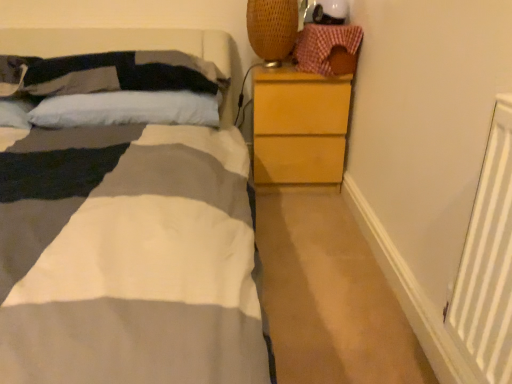
Image resolution: width=512 pixels, height=384 pixels. Describe the element at coordinates (127, 109) in the screenshot. I see `white soft pillow at upper left, the first pillow positioned from the bottom` at that location.

Locate an element on the screen. The image size is (512, 384). white soft pillow at upper left, the first pillow positioned from the bottom is located at coordinates (127, 109).

Describe the element at coordinates (324, 45) in the screenshot. I see `checkered fabric basket at upper right` at that location.

At what (x,y) coordinates should I click in order to perform the action: click on light brown wooden chest of drawers at right. Please return your answer as a coordinate pair (x, y). This screenshot has height=384, width=512. Looking at the image, I should click on (298, 126).

Which object is further away from the camera, light brown wooden chest of drawers at right or checkered fabric basket at upper right?

Positioned behind is light brown wooden chest of drawers at right.

Could you tell me if light brown wooden chest of drawers at right is turned towards checkered fabric basket at upper right?

No, light brown wooden chest of drawers at right does not turn towards checkered fabric basket at upper right.

From the picture: Is light brown wooden chest of drawers at right inside or outside of checkered fabric basket at upper right?

The correct answer is: outside.

Does light brown wooden chest of drawers at right appear on the right side of checkered fabric basket at upper right?

In fact, light brown wooden chest of drawers at right is to the left of checkered fabric basket at upper right.

Is point (157, 97) closer or farther from the camera than point (351, 32)?

Clearly, point (157, 97) is closer to the camera than point (351, 32).

Is checkered fabric basket at upper right at the back of white soft pillow at upper left, acting as the 2th pillow starting from the top?

No.

Considering the relative sizes of white soft pillow at upper left, acting as the 2th pillow starting from the top, and checkered fabric basket at upper right in the image provided, is white soft pillow at upper left, acting as the 2th pillow starting from the top, bigger than checkered fabric basket at upper right?

Yes.

Which is correct: white soft pillow at upper left, the first pillow positioned from the bottom, is inside checkered fabric basket at upper right, or outside of it?

white soft pillow at upper left, the first pillow positioned from the bottom, exists outside the volume of checkered fabric basket at upper right.

Considering the relative sizes of white soft pillow at upper left, the first pillow positioned from the bottom, and light brown wooden chest of drawers at right in the image provided, is white soft pillow at upper left, the first pillow positioned from the bottom, shorter than light brown wooden chest of drawers at right?

Indeed, white soft pillow at upper left, the first pillow positioned from the bottom, has a lesser height compared to light brown wooden chest of drawers at right.

Is white soft pillow at upper left, the first pillow positioned from the bottom, inside the boundaries of light brown wooden chest of drawers at right, or outside?

white soft pillow at upper left, the first pillow positioned from the bottom, is outside light brown wooden chest of drawers at right.

Considering the relative sizes of white soft pillow at upper left, acting as the 2th pillow starting from the top, and light brown wooden chest of drawers at right in the image provided, is white soft pillow at upper left, acting as the 2th pillow starting from the top, smaller than light brown wooden chest of drawers at right?

Indeed, white soft pillow at upper left, acting as the 2th pillow starting from the top, has a smaller size compared to light brown wooden chest of drawers at right.

Considering the relative sizes of soft cotton pillow at upper left, the 1th pillow positioned from the top, and light brown wooden chest of drawers at right in the image provided, is soft cotton pillow at upper left, the 1th pillow positioned from the top, smaller than light brown wooden chest of drawers at right?

Indeed, soft cotton pillow at upper left, the 1th pillow positioned from the top, has a smaller size compared to light brown wooden chest of drawers at right.

Is soft cotton pillow at upper left, the 1th pillow positioned from the top, with light brown wooden chest of drawers at right?

There is a gap between soft cotton pillow at upper left, the 1th pillow positioned from the top, and light brown wooden chest of drawers at right.

Relative to light brown wooden chest of drawers at right, is soft cotton pillow at upper left, the 2th pillow in the bottom-to-top sequence, in front or behind?

Visually, soft cotton pillow at upper left, the 2th pillow in the bottom-to-top sequence, is located in front of light brown wooden chest of drawers at right.

Is soft cotton pillow at upper left, the 2th pillow in the bottom-to-top sequence, facing towards checkered fabric basket at upper right?

No.

Looking at their sizes, would you say soft cotton pillow at upper left, the 2th pillow in the bottom-to-top sequence, is wider or thinner than checkered fabric basket at upper right?

In the image, soft cotton pillow at upper left, the 2th pillow in the bottom-to-top sequence, appears to be wider than checkered fabric basket at upper right.

Consider the image. Relative to checkered fabric basket at upper right, is soft cotton pillow at upper left, the 2th pillow in the bottom-to-top sequence, in front or behind?

Visually, soft cotton pillow at upper left, the 2th pillow in the bottom-to-top sequence, is located in front of checkered fabric basket at upper right.

How many degrees apart are the facing directions of checkered fabric basket at upper right and light brown wooden chest of drawers at right?

There is a 0.000561-degree angle between the facing directions of checkered fabric basket at upper right and light brown wooden chest of drawers at right.

Is checkered fabric basket at upper right located outside light brown wooden chest of drawers at right?

Yes, checkered fabric basket at upper right is not within light brown wooden chest of drawers at right.

Where is `the chest of drawers lying behind the checkered fabric basket at upper right`? The height and width of the screenshot is (384, 512). the chest of drawers lying behind the checkered fabric basket at upper right is located at coordinates (298, 126).

Considering the sizes of soft cotton pillow at upper left, the 2th pillow in the bottom-to-top sequence, and white soft pillow at upper left, acting as the 2th pillow starting from the top, in the image, is soft cotton pillow at upper left, the 2th pillow in the bottom-to-top sequence, wider or thinner than white soft pillow at upper left, acting as the 2th pillow starting from the top,?

soft cotton pillow at upper left, the 2th pillow in the bottom-to-top sequence, is wider than white soft pillow at upper left, acting as the 2th pillow starting from the top.

Image resolution: width=512 pixels, height=384 pixels. I want to click on pillow located on the left of white soft pillow at upper left, the first pillow positioned from the bottom, so (110, 73).

Is soft cotton pillow at upper left, the 1th pillow positioned from the top, facing towards white soft pillow at upper left, the first pillow positioned from the bottom?

No, soft cotton pillow at upper left, the 1th pillow positioned from the top, is not turned towards white soft pillow at upper left, the first pillow positioned from the bottom.

Image resolution: width=512 pixels, height=384 pixels. In order to click on material on the right side of light brown wooden chest of drawers at right in this screenshot , I will do `click(324, 45)`.

Identify the location of the 1st pillow in front of the checkered fabric basket at upper right, counting from the anchor's position. (127, 109).

When comparing their distances from checkered fabric basket at upper right, does light brown wooden chest of drawers at right or soft cotton pillow at upper left, the 2th pillow in the bottom-to-top sequence, seem further?

soft cotton pillow at upper left, the 2th pillow in the bottom-to-top sequence, is further to checkered fabric basket at upper right.

When comparing their distances from light brown wooden chest of drawers at right, does checkered fabric basket at upper right or white soft pillow at upper left, acting as the 2th pillow starting from the top, seem further?

white soft pillow at upper left, acting as the 2th pillow starting from the top, lies further to light brown wooden chest of drawers at right than the other object.

Based on the photo, estimate the real-world distances between objects in this image. Which object is closer to checkered fabric basket at upper right, soft cotton pillow at upper left, the 1th pillow positioned from the top, or light brown wooden chest of drawers at right?

light brown wooden chest of drawers at right lies closer to checkered fabric basket at upper right than the other object.

Looking at the image, which one is located closer to white soft pillow at upper left, the first pillow positioned from the bottom, checkered fabric basket at upper right or light brown wooden chest of drawers at right?

Among the two, light brown wooden chest of drawers at right is located nearer to white soft pillow at upper left, the first pillow positioned from the bottom.

When comparing their distances from white soft pillow at upper left, acting as the 2th pillow starting from the top, does light brown wooden chest of drawers at right or checkered fabric basket at upper right seem further?

The object further to white soft pillow at upper left, acting as the 2th pillow starting from the top, is checkered fabric basket at upper right.

Based on their spatial positions, is white soft pillow at upper left, the first pillow positioned from the bottom, or checkered fabric basket at upper right further from light brown wooden chest of drawers at right?

The object further to light brown wooden chest of drawers at right is white soft pillow at upper left, the first pillow positioned from the bottom.

Looking at the image, which one is located closer to soft cotton pillow at upper left, the 1th pillow positioned from the top, light brown wooden chest of drawers at right or white soft pillow at upper left, the first pillow positioned from the bottom?

white soft pillow at upper left, the first pillow positioned from the bottom, is positioned closer to the anchor soft cotton pillow at upper left, the 1th pillow positioned from the top.

Based on their spatial positions, is soft cotton pillow at upper left, the 1th pillow positioned from the top, or white soft pillow at upper left, the first pillow positioned from the bottom, closer to checkered fabric basket at upper right?

Among the two, white soft pillow at upper left, the first pillow positioned from the bottom, is located nearer to checkered fabric basket at upper right.

Where is `the chest of drawers located between white soft pillow at upper left, acting as the 2th pillow starting from the top, and checkered fabric basket at upper right in the left-right direction`? The height and width of the screenshot is (384, 512). the chest of drawers located between white soft pillow at upper left, acting as the 2th pillow starting from the top, and checkered fabric basket at upper right in the left-right direction is located at coordinates (298, 126).

The image size is (512, 384). What are the coordinates of `pillow located between soft cotton pillow at upper left, the 2th pillow in the bottom-to-top sequence, and checkered fabric basket at upper right in the left-right direction` in the screenshot? It's located at (127, 109).

At what (x,y) coordinates should I click in order to perform the action: click on chest of drawers between soft cotton pillow at upper left, the 2th pillow in the bottom-to-top sequence, and checkered fabric basket at upper right from left to right. Please return your answer as a coordinate pair (x, y). The width and height of the screenshot is (512, 384). Looking at the image, I should click on (298, 126).

You are a GUI agent. You are given a task and a screenshot of the screen. Output one action in this format:
    pyautogui.click(x=<x>, y=<y>)
    Task: Click on the pillow between soft cotton pillow at upper left, the 2th pillow in the bottom-to-top sequence, and light brown wooden chest of drawers at right, in the horizontal direction
    
    Given the screenshot: What is the action you would take?
    pyautogui.click(x=127, y=109)